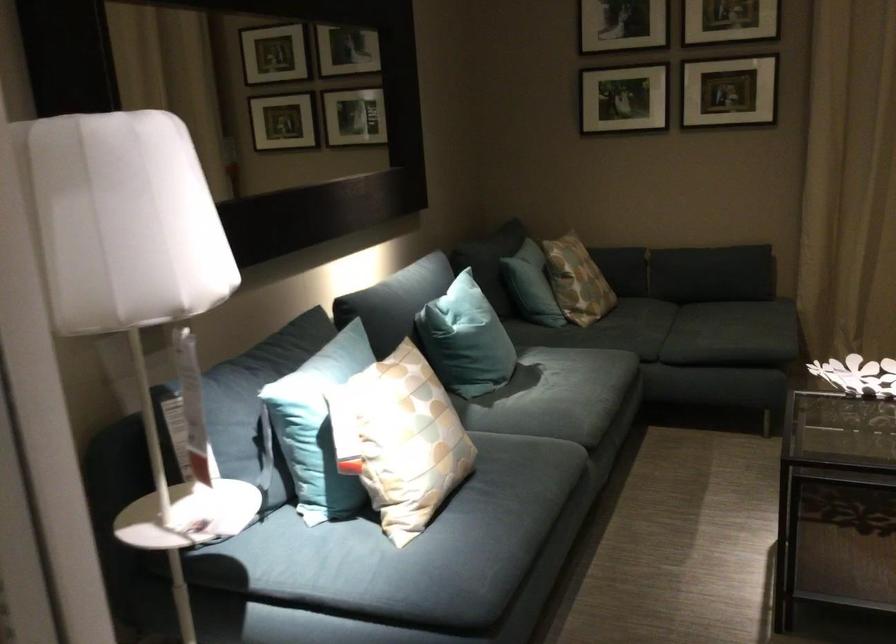
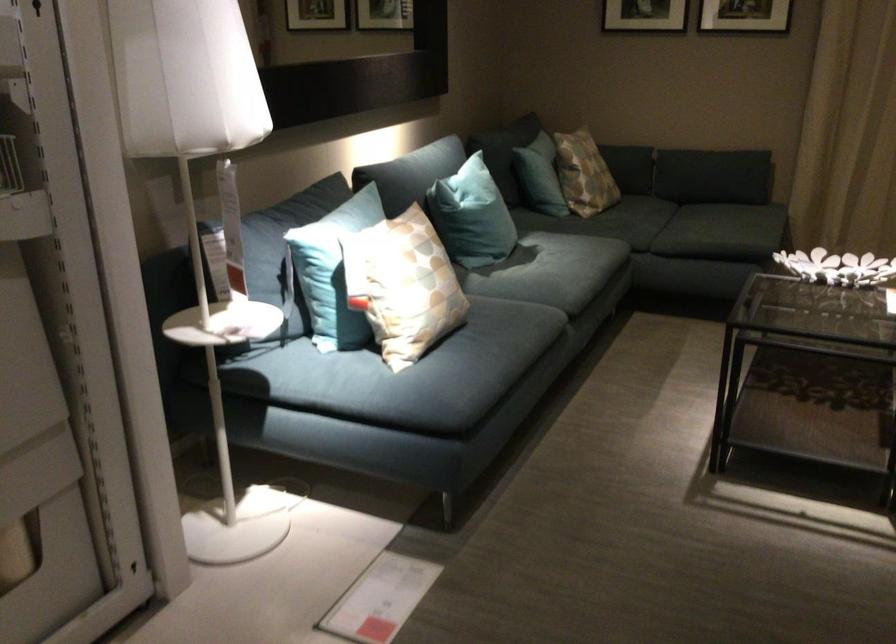
The point at (315,430) is marked in the first image. Where is the corresponding point in the second image?

(332, 270)